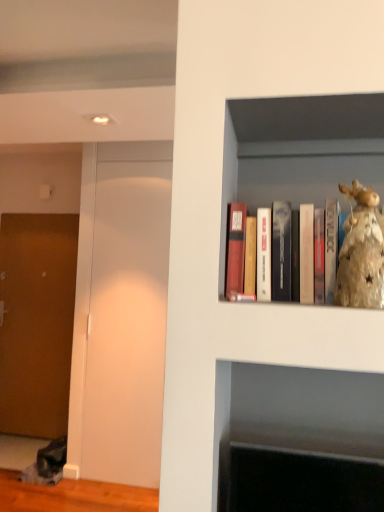
What are the coordinates of `transparent glass door at left` in the screenshot? It's located at (120, 313).

Describe the element at coordinates (361, 252) in the screenshot. I see `shiny gold figurine at upper right` at that location.

This screenshot has height=512, width=384. Identify the location of transparent glass door at left. (120, 313).

Is matte wooden books at upper right smaller than brown textured door at left?

Yes.

From the image's perspective, is matte wooden books at upper right over brown textured door at left?

Yes, from the image's perspective, matte wooden books at upper right is on top of brown textured door at left.

From a real-world perspective, is matte wooden books at upper right positioned above or below brown textured door at left?

Clearly, from a real-world perspective, matte wooden books at upper right is above brown textured door at left.

Is matte wooden books at upper right thinner than brown textured door at left?

No.

Is transparent glass door at left oriented away from brown textured door at left?

No.

Considering the relative positions of transparent glass door at left and brown textured door at left in the image provided, is transparent glass door at left behind brown textured door at left?

No.

Does transparent glass door at left have a greater width compared to brown textured door at left?

No, transparent glass door at left is not wider than brown textured door at left.

From a real-world perspective, between transparent glass door at left and brown textured door at left, who is vertically higher?

transparent glass door at left, from a real-world perspective.

What's the angular difference between shiny gold figurine at upper right and matte wooden books at upper right's facing directions?

There is a 0.000632-degree angle between the facing directions of shiny gold figurine at upper right and matte wooden books at upper right.

Find the location of a particular element. This screenshot has width=384, height=512. figurine in front of the matte wooden books at upper right is located at coordinates (361, 252).

From the image's perspective, is shiny gold figurine at upper right below matte wooden books at upper right?

Yes.

What's the angular difference between transparent glass door at left and shiny gold figurine at upper right's facing directions?

0.00651 degrees separate the facing orientations of transparent glass door at left and shiny gold figurine at upper right.

Considering the relative sizes of transparent glass door at left and shiny gold figurine at upper right in the image provided, is transparent glass door at left thinner than shiny gold figurine at upper right?

Yes, transparent glass door at left is thinner than shiny gold figurine at upper right.

Is transparent glass door at left positioned with its back to shiny gold figurine at upper right?

No, shiny gold figurine at upper right is not at the back of transparent glass door at left.

From the image's perspective, which is above, transparent glass door at left or matte wooden books at upper right?

matte wooden books at upper right.

Is transparent glass door at left oriented towards matte wooden books at upper right?

No, transparent glass door at left is not turned towards matte wooden books at upper right.

Does transparent glass door at left have a greater height compared to matte wooden books at upper right?

Yes.

This screenshot has width=384, height=512. What are the coordinates of `shelf in front of the transparent glass door at left` in the screenshot? It's located at (299, 151).

Is brown textured door at left turned away from shiny gold figurine at upper right?

No, brown textured door at left is not facing away from shiny gold figurine at upper right.

Considering the sizes of objects brown textured door at left and shiny gold figurine at upper right in the image provided, who is taller, brown textured door at left or shiny gold figurine at upper right?

brown textured door at left.

From the picture: Is shiny gold figurine at upper right completely or partially outside of brown textured door at left?

Yes, shiny gold figurine at upper right is outside of brown textured door at left.

Consider the image. Is shiny gold figurine at upper right not near brown textured door at left?

shiny gold figurine at upper right is positioned a significant distance from brown textured door at left.

In the scene shown: Does shiny gold figurine at upper right have a greater height compared to brown textured door at left?

No, shiny gold figurine at upper right is not taller than brown textured door at left.

Identify the location of door on the left of matte wooden books at upper right. click(x=36, y=321).

Where is `door below the transparent glass door at left (from a real-world perspective)`? door below the transparent glass door at left (from a real-world perspective) is located at coordinates (36, 321).

From the image, which object appears to be nearer to matte wooden books at upper right, brown textured door at left or transparent glass door at left?

The object closer to matte wooden books at upper right is transparent glass door at left.

Estimate the real-world distances between objects in this image. Which object is closer to transparent glass door at left, matte wooden books at upper right or shiny gold figurine at upper right?

matte wooden books at upper right is closer to transparent glass door at left.

Which object lies further to the anchor point brown textured door at left, matte wooden books at upper right or transparent glass door at left?

matte wooden books at upper right lies further to brown textured door at left than the other object.

Based on their spatial positions, is transparent glass door at left or matte wooden books at upper right closer to shiny gold figurine at upper right?

Based on the image, matte wooden books at upper right appears to be nearer to shiny gold figurine at upper right.

When comparing their distances from brown textured door at left, does shiny gold figurine at upper right or matte wooden books at upper right seem closer?

matte wooden books at upper right is closer to brown textured door at left.

When comparing their distances from shiny gold figurine at upper right, does transparent glass door at left or brown textured door at left seem further?

Among the two, brown textured door at left is located further to shiny gold figurine at upper right.

Looking at the image, which one is located further to brown textured door at left, matte wooden books at upper right or shiny gold figurine at upper right?

shiny gold figurine at upper right lies further to brown textured door at left than the other object.

From the image, which object appears to be farther from brown textured door at left, transparent glass door at left or shiny gold figurine at upper right?

shiny gold figurine at upper right.

Locate an element on the screen. The width and height of the screenshot is (384, 512). shelf between shiny gold figurine at upper right and brown textured door at left from front to back is located at coordinates (299, 151).

The width and height of the screenshot is (384, 512). Identify the location of glass door located between matte wooden books at upper right and brown textured door at left in the depth direction. (120, 313).

Where is `shelf positioned between shiny gold figurine at upper right and transparent glass door at left from near to far`? The width and height of the screenshot is (384, 512). shelf positioned between shiny gold figurine at upper right and transparent glass door at left from near to far is located at coordinates (299, 151).

The image size is (384, 512). What are the coordinates of `glass door positioned between shiny gold figurine at upper right and brown textured door at left from near to far` in the screenshot? It's located at (120, 313).